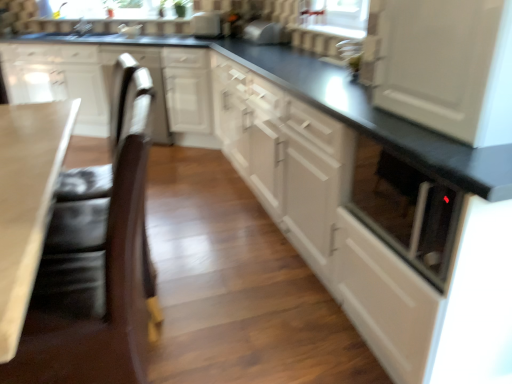
Question: Is brown leather swivel chair at left, the 1th swivel chair viewed from the front, next to matte white vase at upper center and touching it?

Choices:
 (A) no
 (B) yes

Answer: (A)

Question: Is brown leather swivel chair at left, the 1th swivel chair viewed from the front, located outside matte white vase at upper center?

Choices:
 (A) no
 (B) yes

Answer: (B)

Question: Could you tell me if brown leather swivel chair at left, the 1th swivel chair viewed from the front, is turned towards matte white vase at upper center?

Choices:
 (A) no
 (B) yes

Answer: (A)

Question: From the image's perspective, is brown leather swivel chair at left, which is counted as the second swivel chair, starting from the back, under matte white vase at upper center?

Choices:
 (A) yes
 (B) no

Answer: (A)

Question: Does brown leather swivel chair at left, which is counted as the second swivel chair, starting from the back, appear on the left side of matte white vase at upper center?

Choices:
 (A) yes
 (B) no

Answer: (B)

Question: Considering the relative sizes of brown leather swivel chair at left, the 1th swivel chair viewed from the front, and matte white vase at upper center in the image provided, is brown leather swivel chair at left, the 1th swivel chair viewed from the front, smaller than matte white vase at upper center?

Choices:
 (A) no
 (B) yes

Answer: (A)

Question: Is white glossy cabinet at upper left, acting as the 2th cabinetry starting from the left, taller than smooth beige countertop at lower left?

Choices:
 (A) no
 (B) yes

Answer: (B)

Question: Is white glossy cabinet at upper left, acting as the 2th cabinetry starting from the left, next to smooth beige countertop at lower left?

Choices:
 (A) no
 (B) yes

Answer: (A)

Question: Is white glossy cabinet at upper left, acting as the 2th cabinetry starting from the left, wider than smooth beige countertop at lower left?

Choices:
 (A) yes
 (B) no

Answer: (B)

Question: Is white glossy cabinet at upper left, marked as the third cabinetry in a right-to-left arrangement, oriented towards smooth beige countertop at lower left?

Choices:
 (A) no
 (B) yes

Answer: (B)

Question: Considering the relative sizes of white glossy cabinet at upper left, marked as the third cabinetry in a right-to-left arrangement, and smooth beige countertop at lower left in the image provided, is white glossy cabinet at upper left, marked as the third cabinetry in a right-to-left arrangement, bigger than smooth beige countertop at lower left?

Choices:
 (A) yes
 (B) no

Answer: (A)

Question: Is smooth beige countertop at lower left at the back of white glossy cabinet at upper left, marked as the third cabinetry in a right-to-left arrangement?

Choices:
 (A) yes
 (B) no

Answer: (B)

Question: Does smooth beige countertop at lower left lie in front of white glossy cabinet at left, the 4th cabinetry from the right?

Choices:
 (A) no
 (B) yes

Answer: (B)